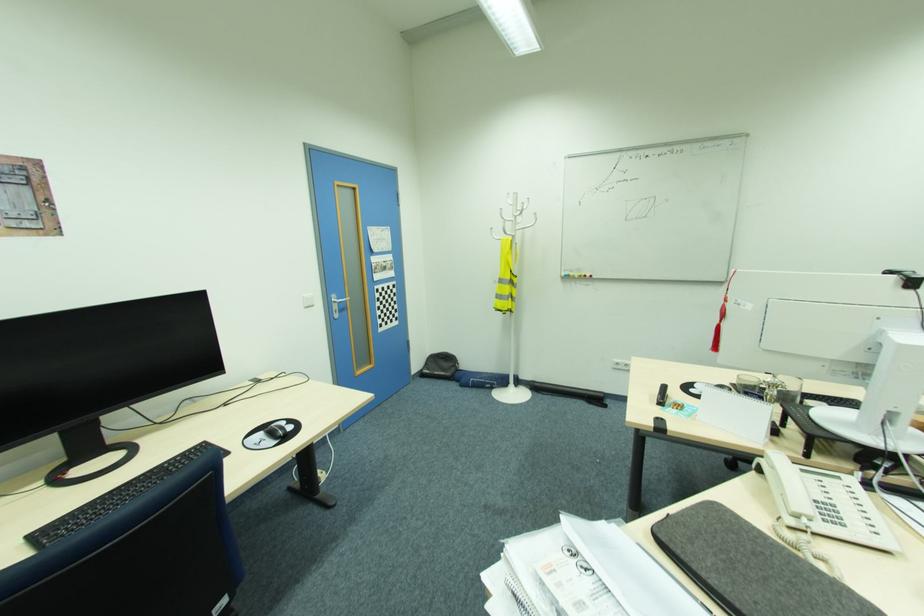
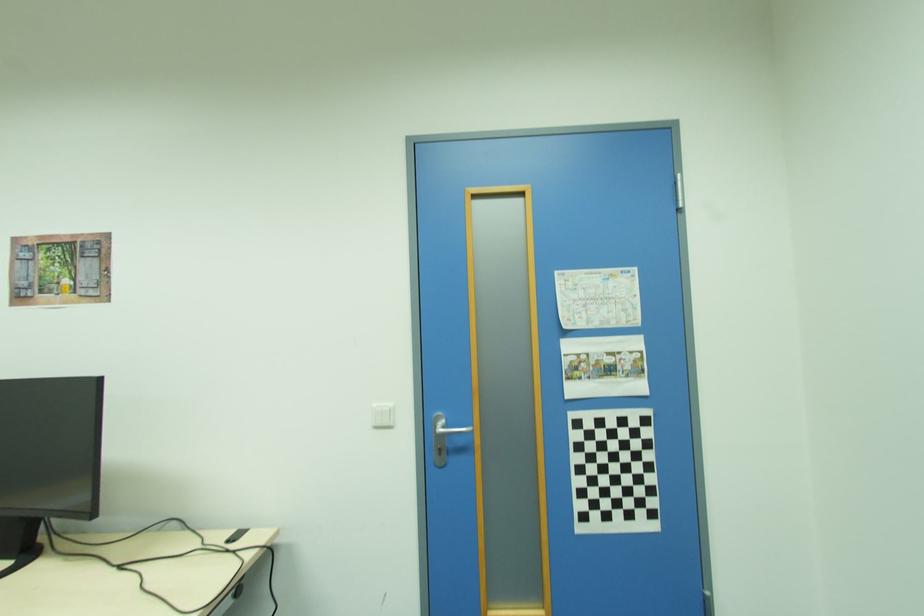
Locate, in the second image, the point that corresponds to pixel 314 306 in the first image.

(394, 427)